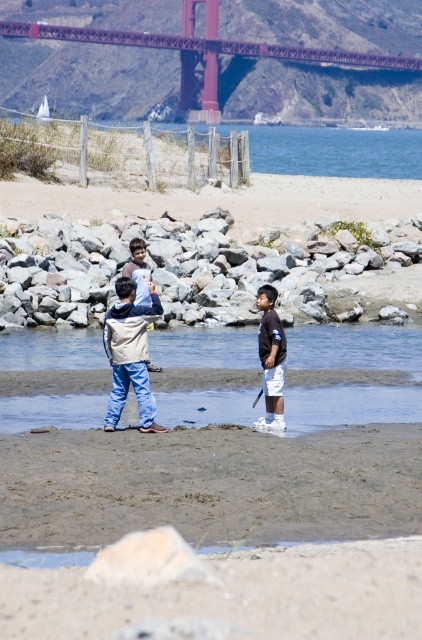
Question: Which object appears farthest from the camera in this image?

Choices:
 (A) dark brown jersey at center
 (B) rustic steel bridge at upper center
 (C) light blue denim pants at center

Answer: (B)

Question: Which object is positioned closest to the light blue denim pants at center?

Choices:
 (A) white sand at lower center
 (B) rustic steel bridge at upper center

Answer: (A)

Question: Among these objects, which one is nearest to the camera?

Choices:
 (A) light blue denim pants at center
 (B) rustic steel bridge at upper center
 (C) white sand at lower center

Answer: (A)

Question: Is light beige sand at lower center further to camera compared to light blue denim pants at center?

Choices:
 (A) yes
 (B) no

Answer: (B)

Question: Can you confirm if rustic steel bridge at upper center is positioned to the left of light beige sand at lower center?

Choices:
 (A) yes
 (B) no

Answer: (A)

Question: Can you confirm if rustic steel bridge at upper center is positioned to the left of white sand at lower center?

Choices:
 (A) no
 (B) yes

Answer: (B)